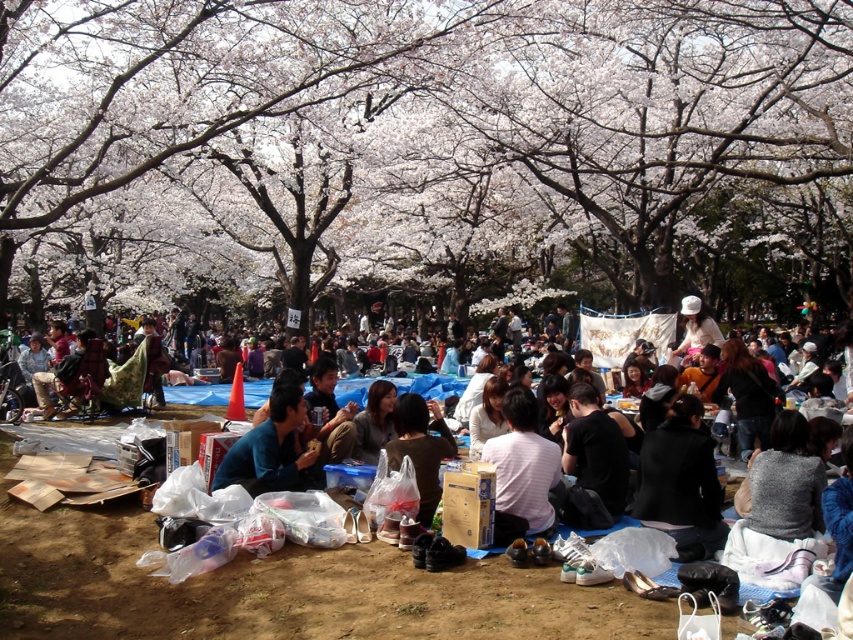
You are a photographer standing at the center of the park and want to capture the white blossoms at center in your shot. If your camera has a focal length of 50mm and you are 10 meters away from the blossoms, what is the approximate size of the blossoms in millimeters on the camera sensor?

The position of the white blossoms at center is at point [424,157], but this information does not provide the actual size of the blossoms. Without knowing the size of the blossoms themselves, it is impossible to calculate their size on the camera sensor.

You are a photographer taking a picture of the striped cotton shirt at center and the blue fabric at center. Which one will appear larger in your photo?

The striped cotton shirt at center will appear larger in the photo because it is closer to the viewer than the blue fabric at center.